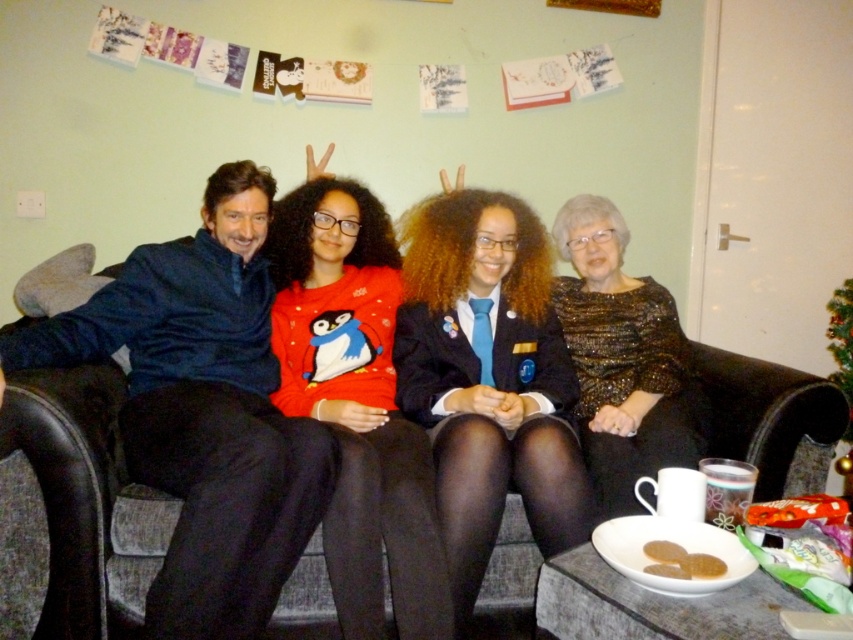
Can you confirm if dark gray fabric couch at center is wider than sparkly gold dress at center?

No, dark gray fabric couch at center is not wider than sparkly gold dress at center.

Where is `dark gray fabric couch at center`? The height and width of the screenshot is (640, 853). dark gray fabric couch at center is located at coordinates 80,508.

Is blue satin blazer at center taller than matte red sweater at center?

Incorrect, blue satin blazer at center's height is not larger of matte red sweater at center's.

Does blue satin blazer at center have a larger size compared to matte red sweater at center?

Incorrect, blue satin blazer at center is not larger than matte red sweater at center.

Which is behind, point (462, 500) or point (386, 246)?

Positioned behind is point (386, 246).

Where is `blue satin blazer at center`? The width and height of the screenshot is (853, 640). blue satin blazer at center is located at coordinates (488, 378).

Who is taller, blue satin blazer at center or sparkly gold dress at center?

With more height is blue satin blazer at center.

The width and height of the screenshot is (853, 640). What do you see at coordinates (488, 378) in the screenshot?
I see `blue satin blazer at center` at bounding box center [488, 378].

Identify the location of blue satin blazer at center. The width and height of the screenshot is (853, 640). (488, 378).